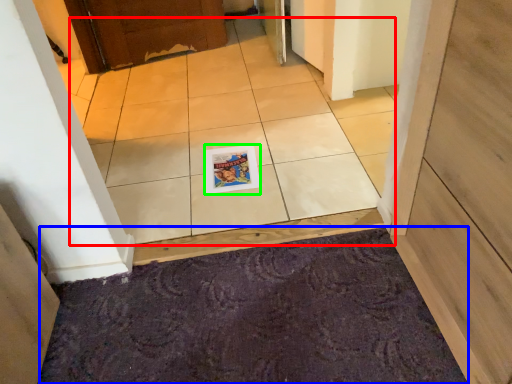
Question: Which object is the farthest from ceramic tile (highlighted by a red box)? Choose among these: doormat (highlighted by a blue box) or magazine (highlighted by a green box).

Choices:
 (A) doormat
 (B) magazine

Answer: (A)